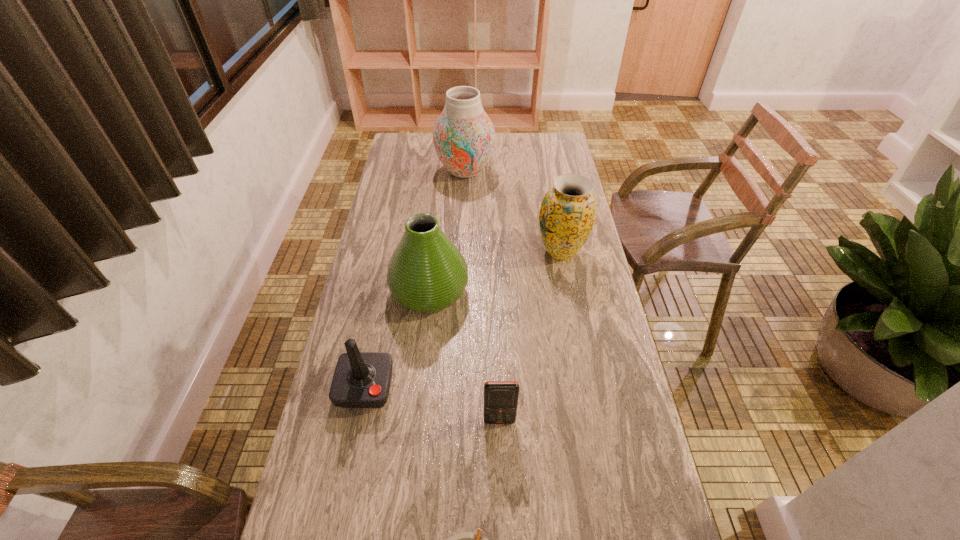
Locate an element on the screen. vase that is at the left edge is located at coordinates (427, 273).

Locate an element on the screen. joystick that is at the left edge is located at coordinates (361, 379).

Locate an element on the screen. object at the right edge is located at coordinates (567, 215).

The height and width of the screenshot is (540, 960). Find the location of `free space at the left edge of the desktop`. free space at the left edge of the desktop is located at coordinates (377, 221).

Find the location of a particular element. This screenshot has width=960, height=540. blank space at the right edge is located at coordinates (582, 384).

Identify the location of vacant space at the far left corner of the desktop. (423, 159).

You are a GUI agent. You are given a task and a screenshot of the screen. Output one action in this format:
    pyautogui.click(x=<x>, y=<y>)
    Task: Click on the unoccupied position between the rightmost vase and the cellular telephone
    The width and height of the screenshot is (960, 540).
    Given the screenshot: What is the action you would take?
    pyautogui.click(x=530, y=336)

Locate an element on the screen. This screenshot has width=960, height=540. free space between the joystick and the cellular telephone is located at coordinates (432, 404).

Where is `vacant region between the fifth farthest object and the rightmost vase`? The image size is (960, 540). vacant region between the fifth farthest object and the rightmost vase is located at coordinates coord(530,336).

The width and height of the screenshot is (960, 540). I want to click on vacant area between the cellular telephone and the tallest vase, so click(x=482, y=296).